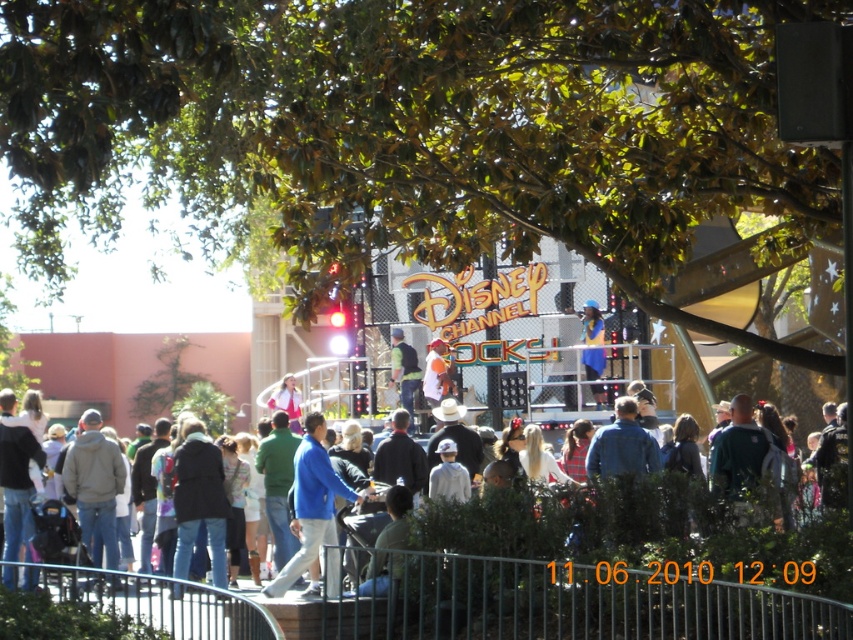
From the picture: Can you confirm if jeans at center is smaller than blue fabric jacket at center?

Incorrect, jeans at center is not smaller in size than blue fabric jacket at center.

Locate an element on the screen. This screenshot has height=640, width=853. jeans at center is located at coordinates tap(637, 531).

Where is `jeans at center`? jeans at center is located at coordinates (x=637, y=531).

Which is below, blue fabric jacket at center or green fabric jacket at center?

blue fabric jacket at center

Is blue fabric jacket at center further to the viewer compared to green fabric jacket at center?

No, blue fabric jacket at center is in front of green fabric jacket at center.

Locate an element on the screen. The height and width of the screenshot is (640, 853). blue fabric jacket at center is located at coordinates (311, 502).

Is point (465, 524) closer to viewer compared to point (393, 337)?

Yes.

Where is `jeans at center`? jeans at center is located at coordinates (637, 531).

Is point (845, 554) more distant than point (405, 390)?

No, (845, 554) is closer to viewer.

I want to click on jeans at center, so click(637, 531).